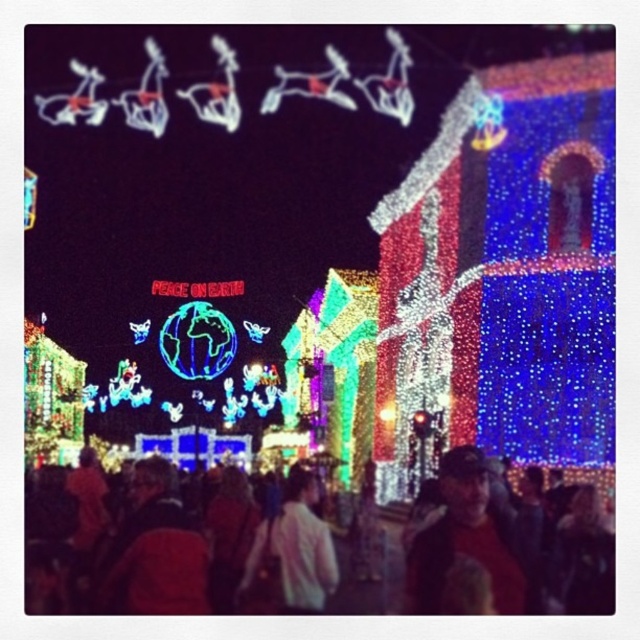
Question: Observing the image, what is the correct spatial positioning of multicolored fabric crowd at center in reference to dark hair at lower right?

Choices:
 (A) above
 (B) below

Answer: (B)

Question: Among these points, which one is farthest from the camera?

Choices:
 (A) [518, 576]
 (B) [173, 515]
 (C) [310, 600]

Answer: (B)

Question: Is multicolored fabric crowd at center to the right of dark hair at lower right from the viewer's perspective?

Choices:
 (A) no
 (B) yes

Answer: (A)

Question: Is multicolored fabric crowd at center wider than white matte jacket at center?

Choices:
 (A) yes
 (B) no

Answer: (A)

Question: Which object is farther from the camera taking this photo?

Choices:
 (A) multicolored fabric crowd at center
 (B) white matte jacket at center

Answer: (B)

Question: Based on their relative distances, which object is farther from the white matte jacket at center?

Choices:
 (A) multicolored fabric crowd at center
 (B) dark hair at lower right

Answer: (B)